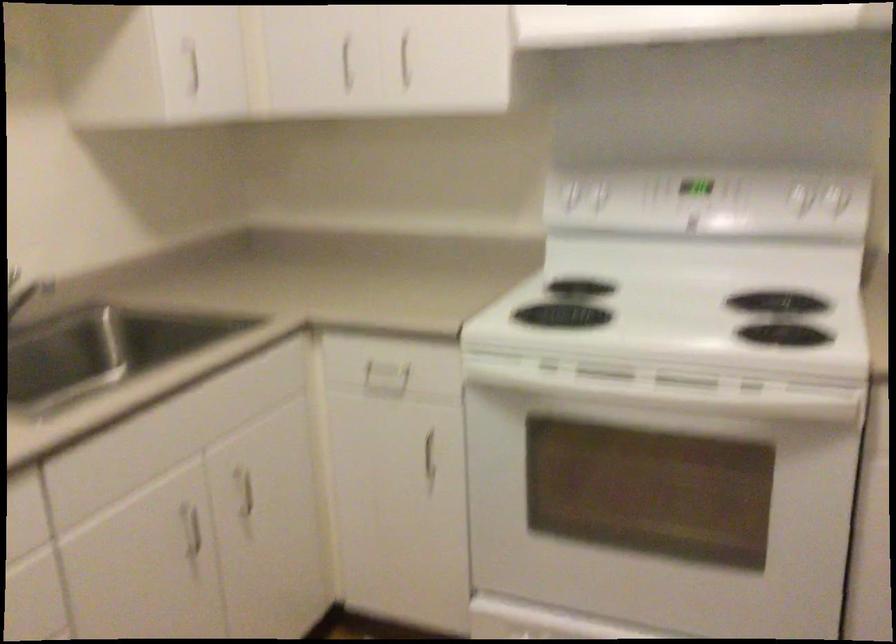
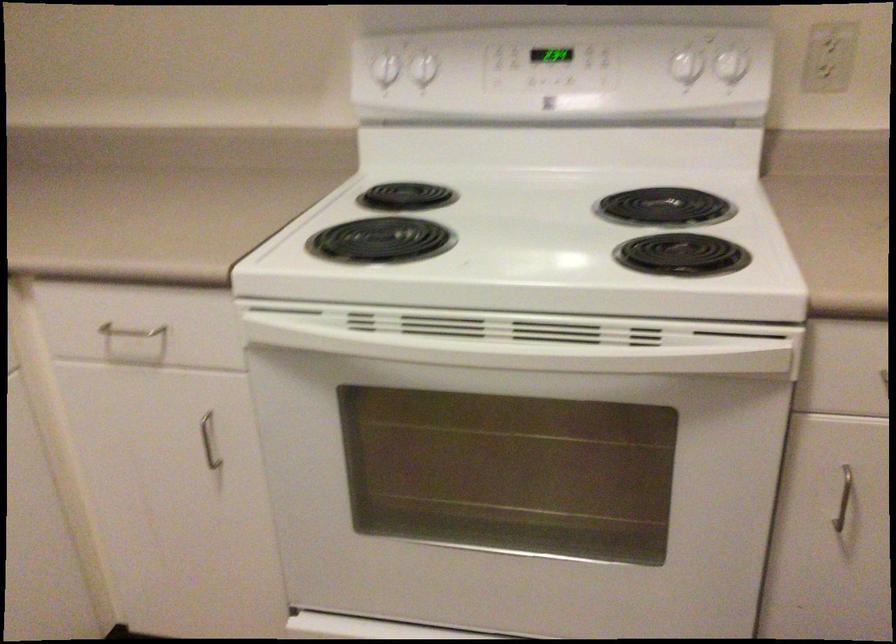
Where in the second image is the point corresponding to (784,299) from the first image?

(664, 207)